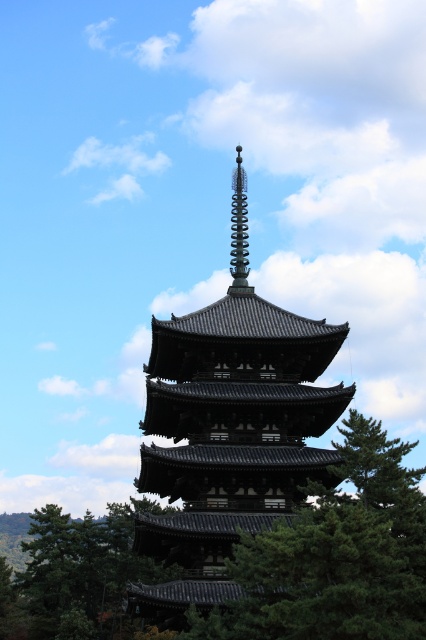
Question: Does shiny dark gray pagoda at center appear on the left side of spiral metal spire at upper center?

Choices:
 (A) no
 (B) yes

Answer: (B)

Question: Is green textured tree at center wider than spiral metal spire at upper center?

Choices:
 (A) no
 (B) yes

Answer: (B)

Question: Which of the following is the farthest from the observer?

Choices:
 (A) shiny dark gray pagoda at center
 (B) spiral metal spire at upper center
 (C) green textured tree at center

Answer: (B)

Question: Estimate the real-world distances between objects in this image. Which object is farther from the green textured tree at center?

Choices:
 (A) green leafy tree at lower left
 (B) shiny dark gray pagoda at center
 (C) spiral metal spire at upper center

Answer: (A)

Question: Does shiny dark gray pagoda at center have a greater width compared to green textured tree at center?

Choices:
 (A) yes
 (B) no

Answer: (A)

Question: Based on their relative distances, which object is farther from the spiral metal spire at upper center?

Choices:
 (A) green leafy tree at lower left
 (B) green textured tree at center
 (C) shiny dark gray pagoda at center

Answer: (A)